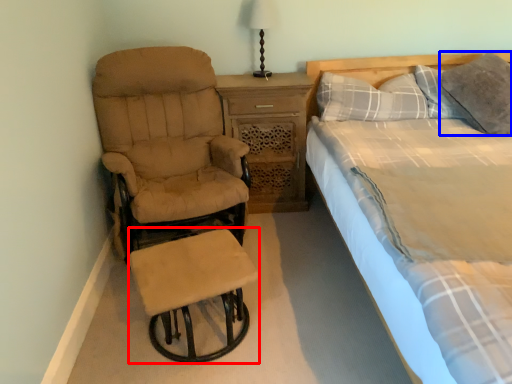
Question: Among these objects, which one is farthest to the camera, bar stool (highlighted by a red box) or pillow (highlighted by a blue box)?

Choices:
 (A) bar stool
 (B) pillow

Answer: (B)